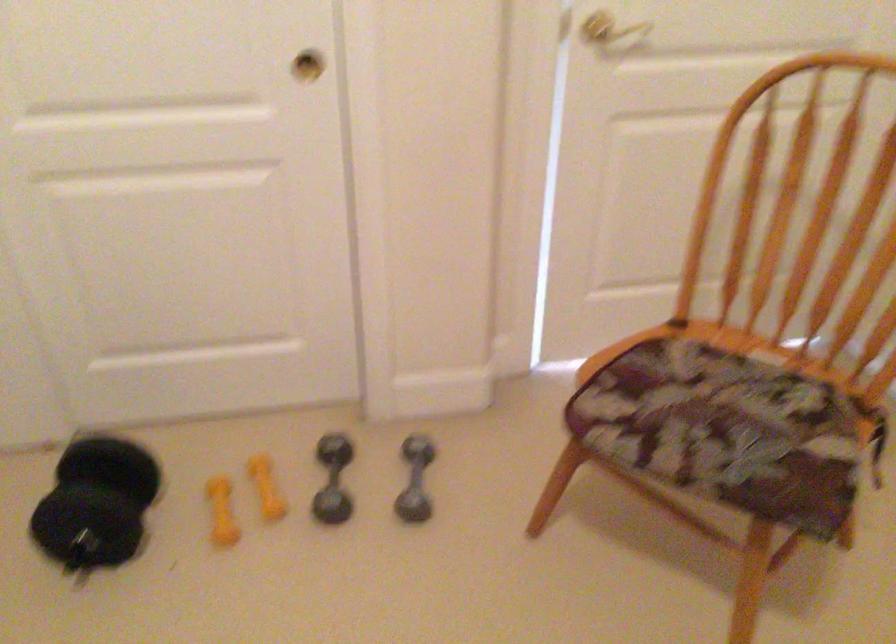
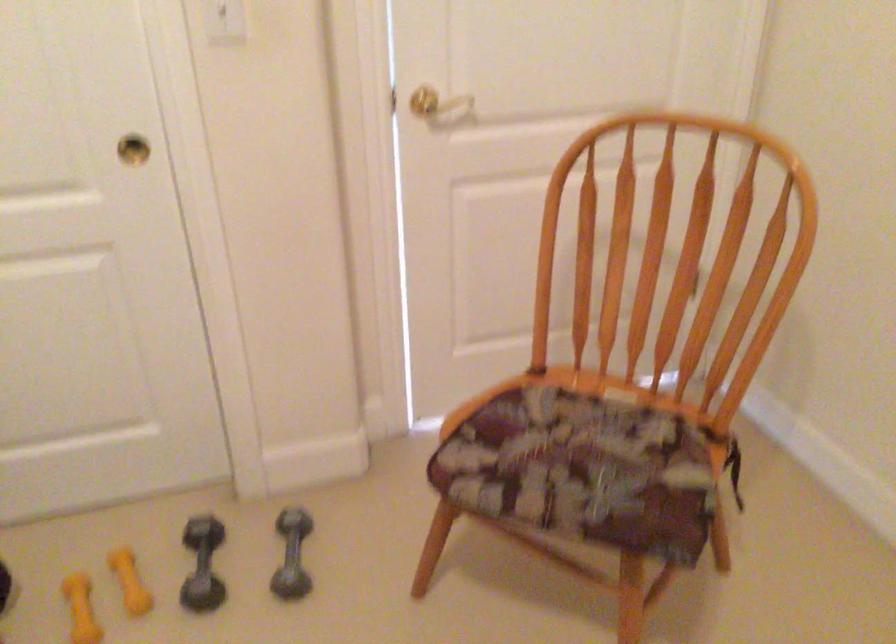
Where in the second image is the point corresponding to [337,476] from the first image?

(202, 565)